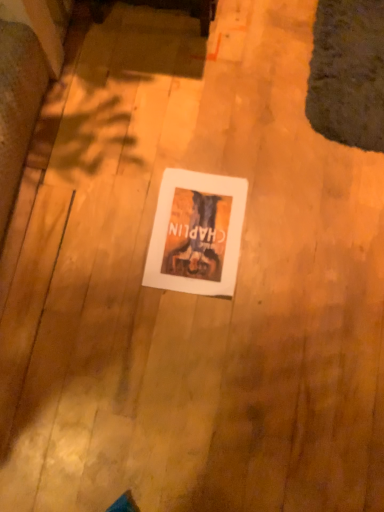
Where is `vacant space situated on the left part of white paper poster at center`? The height and width of the screenshot is (512, 384). vacant space situated on the left part of white paper poster at center is located at coordinates (104, 238).